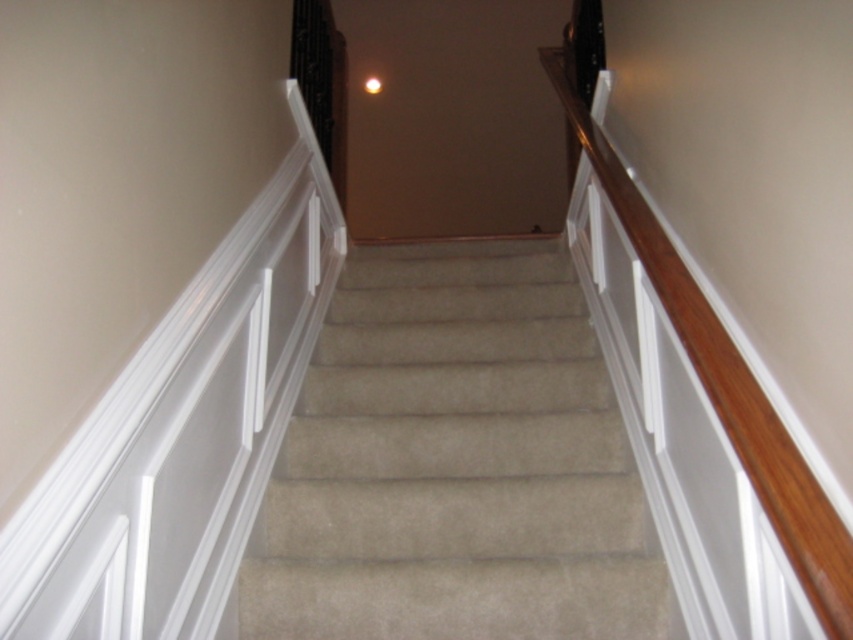
Looking at this image, who is higher up, beige carpet at center or wooden handrail at upper right?

Positioned higher is wooden handrail at upper right.

Looking at this image, which is below, beige carpet at center or wooden handrail at upper right?

beige carpet at center

Does point (514, 532) come in front of point (693, 314)?

No, (514, 532) is further to viewer.

This screenshot has width=853, height=640. I want to click on beige carpet at center, so pyautogui.click(x=456, y=465).